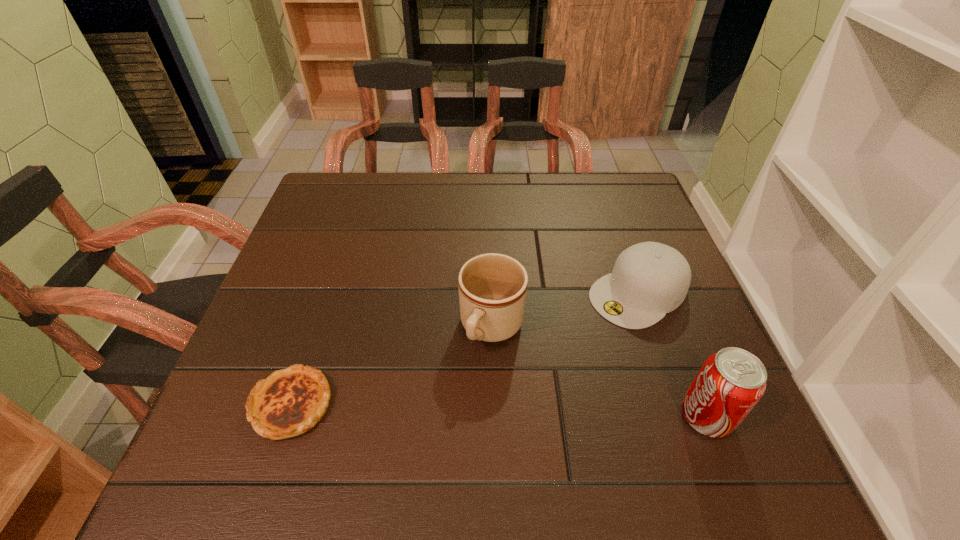
In order to click on quiche in this screenshot , I will do `click(291, 401)`.

The image size is (960, 540). Find the location of `the shortest object`. the shortest object is located at coordinates (291, 401).

At what (x,y) coordinates should I click in order to perform the action: click on soda. Please return your answer as a coordinate pair (x, y). The height and width of the screenshot is (540, 960). Looking at the image, I should click on (730, 383).

Locate an element on the screen. This screenshot has width=960, height=540. the second object from left to right is located at coordinates (492, 287).

This screenshot has width=960, height=540. I want to click on mug, so click(492, 287).

The image size is (960, 540). I want to click on cap, so click(x=649, y=279).

The height and width of the screenshot is (540, 960). Identify the location of vacant region located on the back of the shortest object. (344, 246).

You are a GUI agent. You are given a task and a screenshot of the screen. Output one action in this format:
    pyautogui.click(x=<x>, y=<y>)
    Task: Click on the free region located on the left of the soda
    This screenshot has width=960, height=540.
    Given the screenshot: What is the action you would take?
    pyautogui.click(x=641, y=416)

What are the coordinates of `vacant space located 0.150m on the side of the second object from left to right with the handle` in the screenshot? It's located at (443, 423).

The height and width of the screenshot is (540, 960). I want to click on vacant space situated 0.200m on the front-facing side of the third tallest object, so click(534, 360).